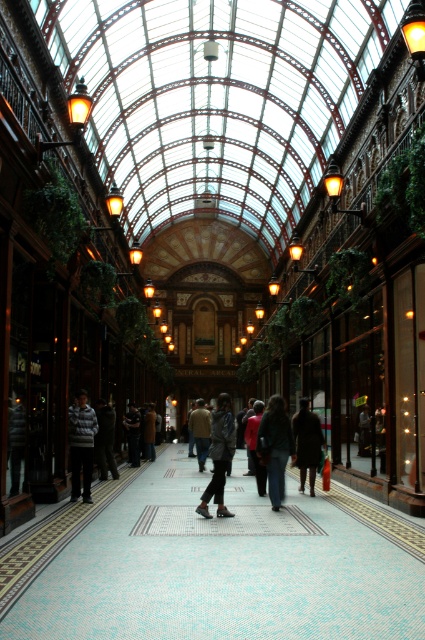
You are a tailor who needs to determine which jacket can accommodate more fabric for alterations. Based on the scene, which jacket between the dark gray jacket at center and the dark brown leather jacket at center would be better suited for this purpose?

The dark gray jacket at center has a larger size compared to the dark brown leather jacket at center, so it can accommodate more fabric for alterations.